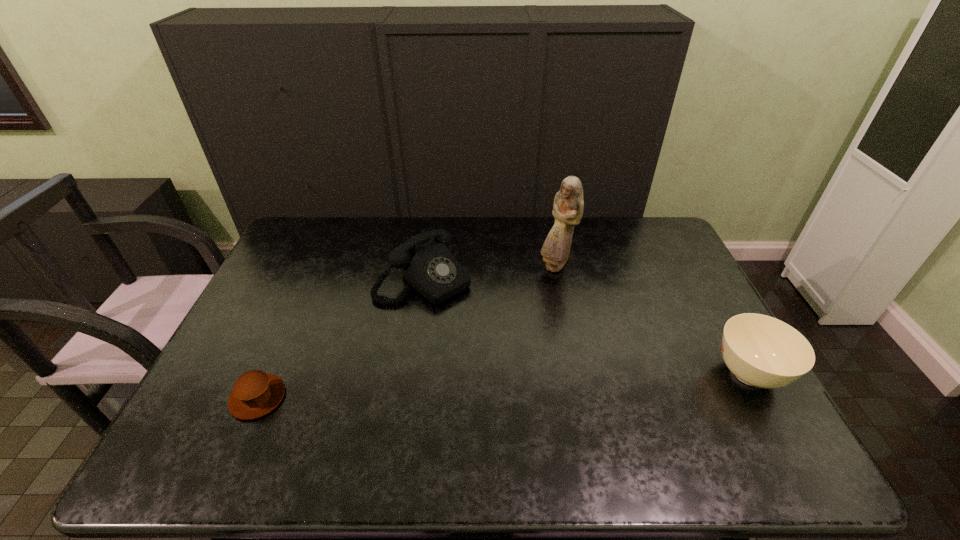
Where is `object situated at the near left corner`? The height and width of the screenshot is (540, 960). object situated at the near left corner is located at coordinates pyautogui.click(x=255, y=393).

Locate an element on the screen. object that is positioned at the near right corner is located at coordinates (762, 351).

This screenshot has width=960, height=540. In the image, there is a desktop. In order to click on blank space at the far edge in this screenshot , I will do `click(391, 237)`.

Identify the location of vacant space at the near edge of the desktop. (509, 423).

Image resolution: width=960 pixels, height=540 pixels. What are the coordinates of `vacant space at the left edge of the desktop` in the screenshot? It's located at coord(223,355).

I want to click on free space at the right edge of the desktop, so click(x=751, y=387).

The width and height of the screenshot is (960, 540). In the image, there is a desktop. Identify the location of vacant space at the far left corner. (312, 218).

Identify the location of free space at the far right corner of the desktop. Image resolution: width=960 pixels, height=540 pixels. (639, 249).

Locate an element on the screen. free area in between the third object from right to left and the sugar bowl is located at coordinates (587, 327).

Find the location of a particular element. vacant space that is in between the third object from left to right and the third object from right to left is located at coordinates (490, 273).